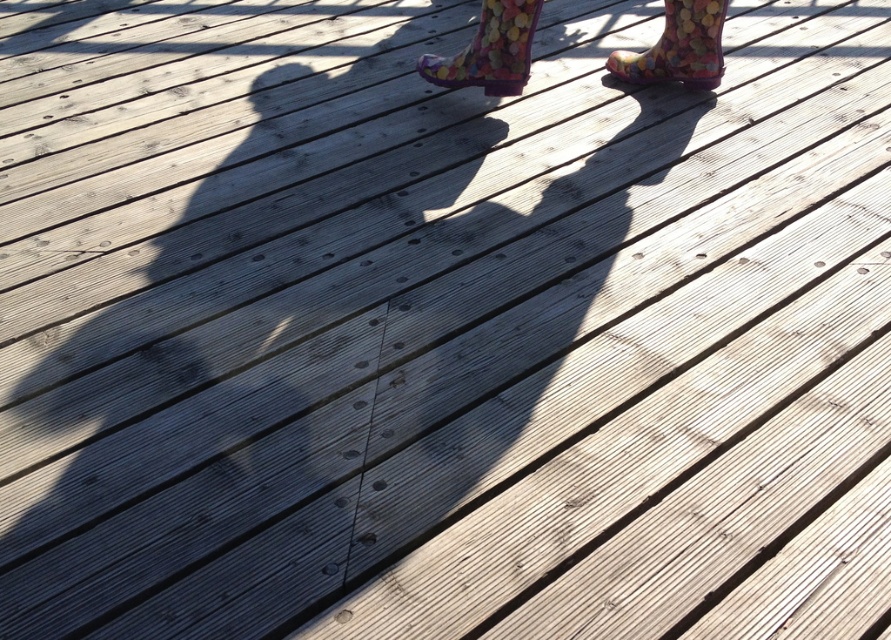
You are a painter who needs to place a 40 cm wide canvas between the floral rubber boot at upper center and the multicolored rubber boot at upper right. Can you fit the canvas between them?

The distance between the floral rubber boot at upper center and the multicolored rubber boot at upper right is 39.76 centimeters. Since the canvas is 40 cm wide, it is slightly too wide to fit between them.